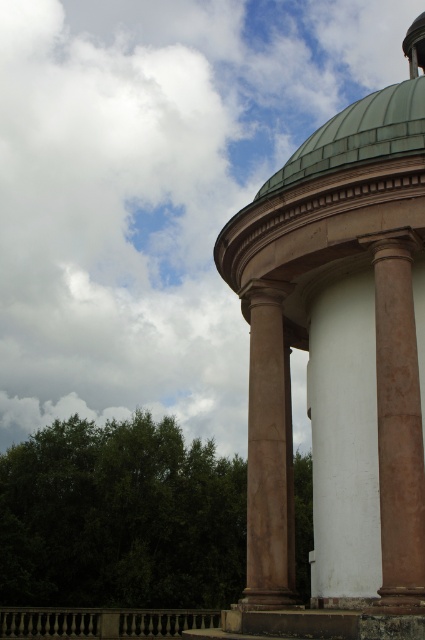
You are standing at the entrance of the classical structure and notice a green leafy tree at lower left and a brown polished column at right. Which object is taller from your viewpoint?

The green leafy tree at lower left is much taller than the brown polished column at right.

You are an architect designing a restoration plan for the classical structure. You need to ensure that the white smooth column at center and the brown marble column at center align properly in height. Which column should you adjust to match the other in terms of height?

The white smooth column at center is shorter than the brown marble column at center. Therefore, you should adjust the white smooth column at center to match the height of the brown marble column at center.

You are standing in front of the classical structure and notice two columns at the center. The white smooth column at center and the brown marble column at center. Which column is placed higher up?

The white smooth column at center is positioned over the brown marble column at center, so it is placed higher up.